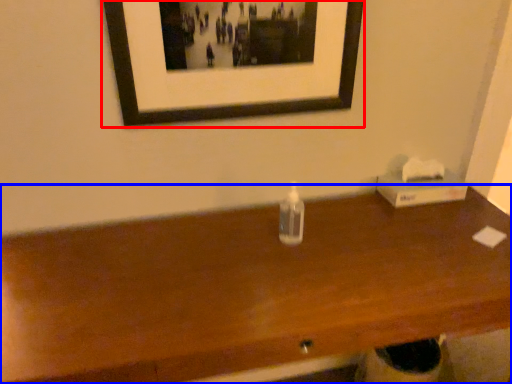
Question: Which of the following is the closest to the observer, picture frame (highlighted by a red box) or table (highlighted by a blue box)?

Choices:
 (A) picture frame
 (B) table

Answer: (B)